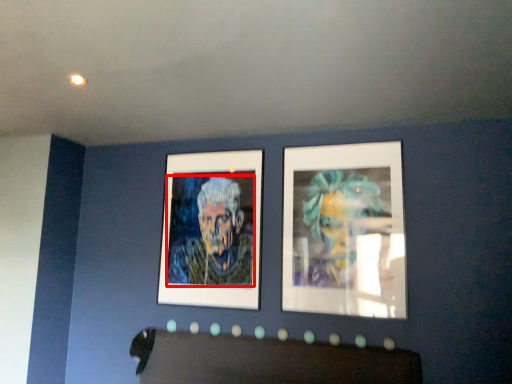
Question: From the image, what is the correct spatial relationship of person (annotated by the red box) in relation to picture frame?

Choices:
 (A) left
 (B) right

Answer: (A)